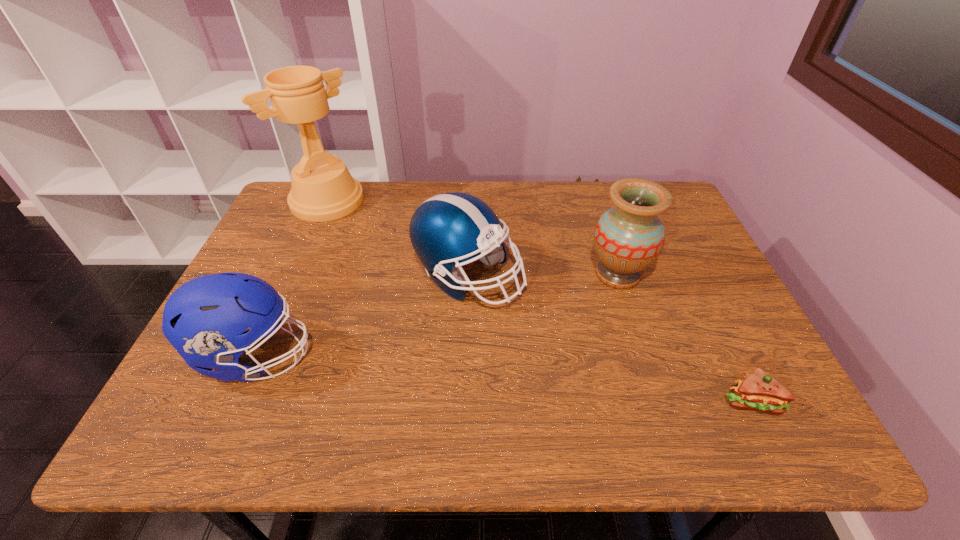
Where is `vacant space located at the front of the farther football helmet with the faceguard`? The image size is (960, 540). vacant space located at the front of the farther football helmet with the faceguard is located at coordinates (667, 276).

This screenshot has width=960, height=540. Identify the location of vacant space located on the front-facing side of the left football helmet. (408, 356).

Locate an element on the screen. free spot located on the left of the sandwich is located at coordinates (663, 401).

Find the location of a particular element. The image size is (960, 540). object that is at the far edge is located at coordinates (323, 189).

The height and width of the screenshot is (540, 960). Identify the location of object situated at the near edge. (759, 391).

Find the location of a particular element. This screenshot has height=540, width=960. award positioned at the left edge is located at coordinates pos(323,189).

The height and width of the screenshot is (540, 960). I want to click on football helmet located at the left edge, so click(x=204, y=319).

Locate an element on the screen. This screenshot has width=960, height=540. object at the right edge is located at coordinates (759, 391).

The height and width of the screenshot is (540, 960). I want to click on object that is at the far left corner, so click(323, 189).

Locate an element on the screen. object situated at the near right corner is located at coordinates (759, 391).